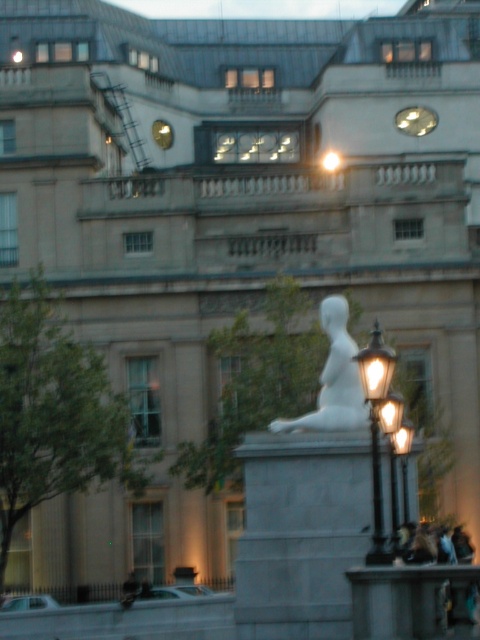
You are standing in front of the classical building and see a point marked at coordinates (334, 380). What does this point indicate?

The point at coordinates (334, 380) marks the location of the white marble statue at center.